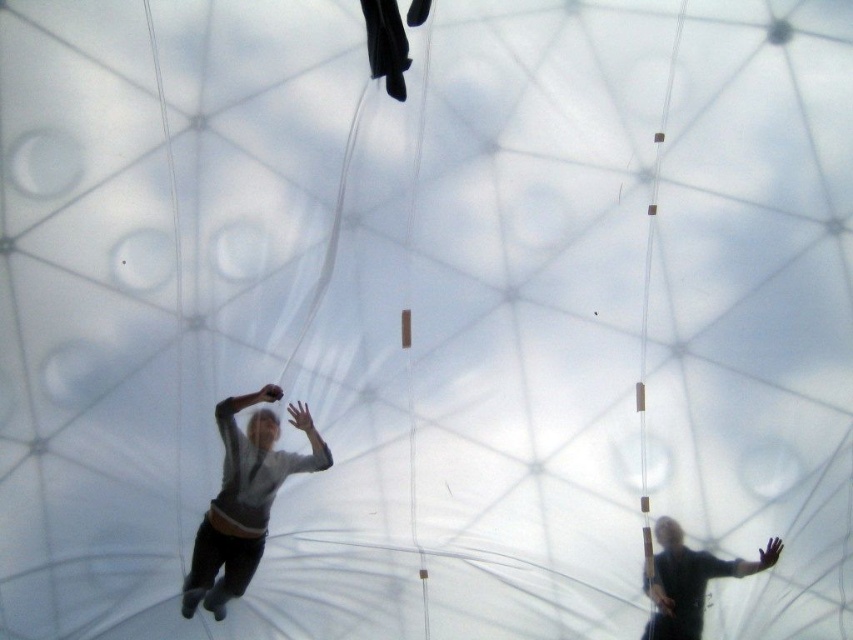
You are standing outside the geodesic dome and want to throw a small ball to someone wearing a light gray sweater at center inside the dome. If the ball can travel 10 meters, will it reach them?

The distance between the light gray sweater at center and the viewer is 9.15 meters. Since the ball can travel 10 meters, it will reach them.

You are a fashion designer observing a person inside the geodesic dome. You notice the light gray sweater at center and the dark matte clothing at center. Which clothing item has a larger size?

The light gray sweater at center is bigger than dark matte clothing at center.

You are inside the geodesic dome and see the point labeled as point (244,499). What object is located at that point?

The point (244,499) indicates the location of the light gray sweater at center.